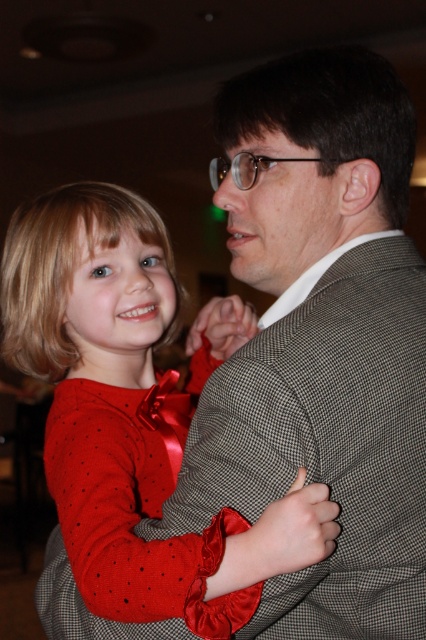
Question: Can you confirm if matte red dress at center is smaller than clear plastic glasses at center?

Choices:
 (A) yes
 (B) no

Answer: (B)

Question: Which of the following is the farthest from the observer?

Choices:
 (A) clear plastic glasses at center
 (B) red satin dress at center

Answer: (A)

Question: Does matte red dress at center appear over clear plastic glasses at center?

Choices:
 (A) no
 (B) yes

Answer: (A)

Question: Which object appears farthest from the camera in this image?

Choices:
 (A) red satin dress at center
 (B) clear plastic glasses at center
 (C) matte red dress at center

Answer: (B)

Question: Is matte red dress at center wider than red satin dress at center?

Choices:
 (A) yes
 (B) no

Answer: (A)

Question: Among these objects, which one is farthest from the camera?

Choices:
 (A) clear plastic glasses at center
 (B) matte red dress at center

Answer: (A)